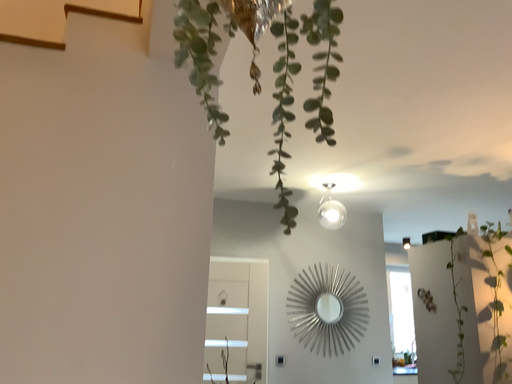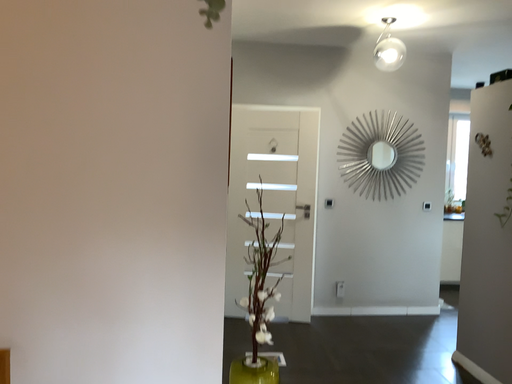
Question: How did the camera likely rotate when shooting the video?

Choices:
 (A) rotated left
 (B) rotated right

Answer: (A)